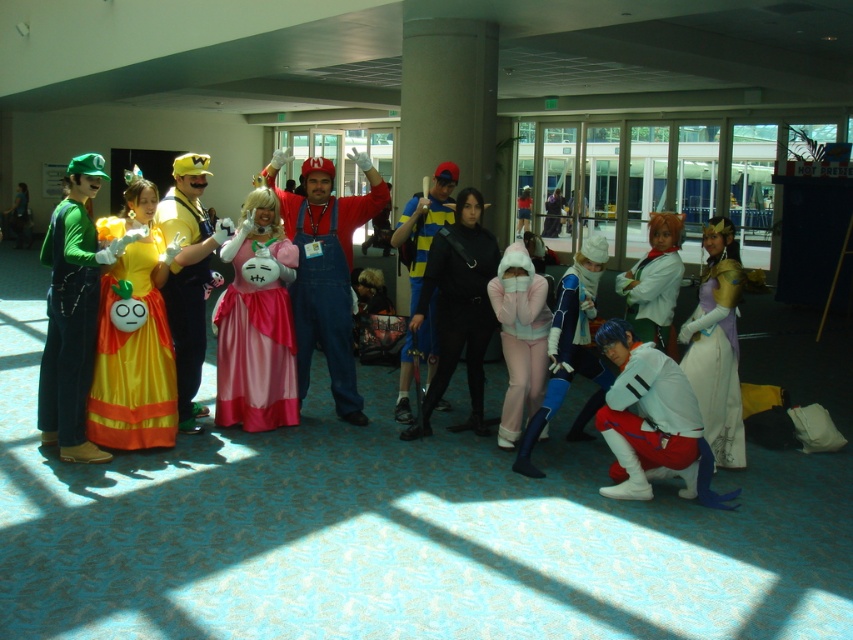
Question: Which is farther from the matte red overalls at center?

Choices:
 (A) pink fleece hoodie at center
 (B) black leather jacket at center

Answer: (A)

Question: Is yellow fabric dress at center to the left of matte black sword at center from the viewer's perspective?

Choices:
 (A) no
 (B) yes

Answer: (B)

Question: Does green matte luigi costume at left appear over purple satin dress at right?

Choices:
 (A) yes
 (B) no

Answer: (A)

Question: Can you confirm if white satin dress at center is positioned to the right of matte black sword at center?

Choices:
 (A) no
 (B) yes

Answer: (A)

Question: Which of these objects is positioned farthest from the yellow fabric dress at center?

Choices:
 (A) matte red overalls at center
 (B) green fabric luigi at left

Answer: (B)

Question: Estimate the real-world distances between objects in this image. Which object is farther from the matte pink dress at center?

Choices:
 (A) green fabric luigi at left
 (B) green matte luigi costume at left
 (C) striped jersey at center

Answer: (A)